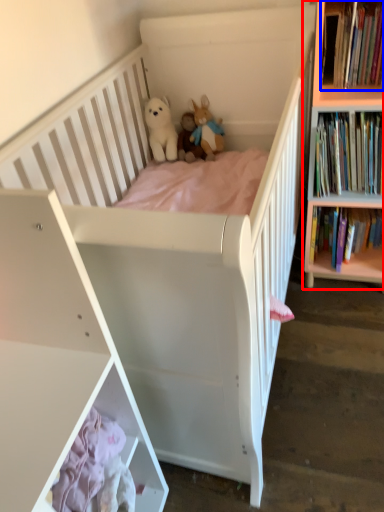
Question: Which object is further to the camera taking this photo, bookcase (highlighted by a red box) or book (highlighted by a blue box)?

Choices:
 (A) bookcase
 (B) book

Answer: (B)